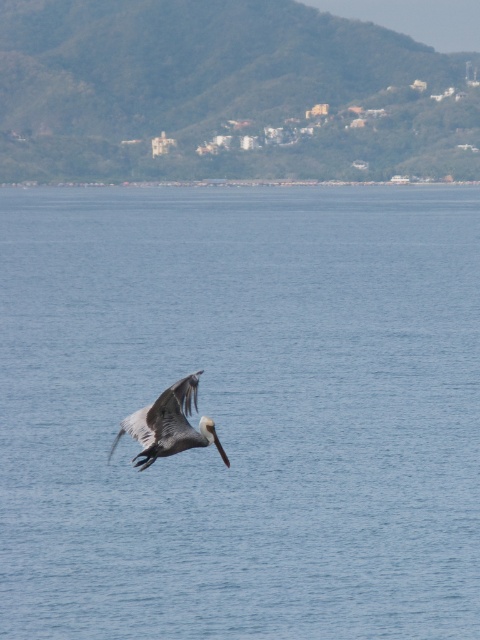
You are a photographer trying to capture the brown feathered pelican at center in your shot. The blue water at center is blocking part of the pelican. Can you adjust your camera angle to see the entire pelican without moving the water?

The blue water at center is taller than the brown feathered pelican at center, so adjusting the camera angle downward might allow you to see the entire pelican without moving the water.

You are a birdwatcher standing on the shore and see the brown feathered pelican at center flying over the blue water at center. If the pelican is flying at a constant speed of 15 feet per second, how long will it take for the pelican to reach the water surface?

The brown feathered pelican at center is 202.35 feet away from the blue water at center. At a speed of 15 feet per second, it will take approximately 13.49 seconds for the pelican to reach the water surface.